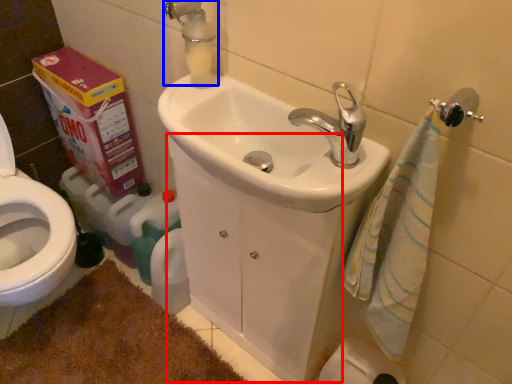
Question: Which object is further to the camera taking this photo, porcelain (highlighted by a red box) or plumbing fixture (highlighted by a blue box)?

Choices:
 (A) porcelain
 (B) plumbing fixture

Answer: (B)